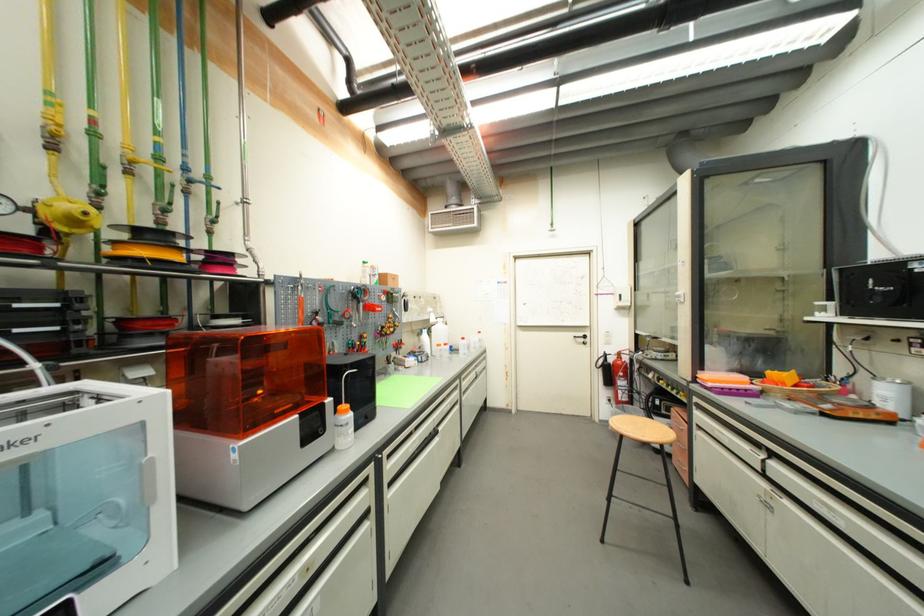
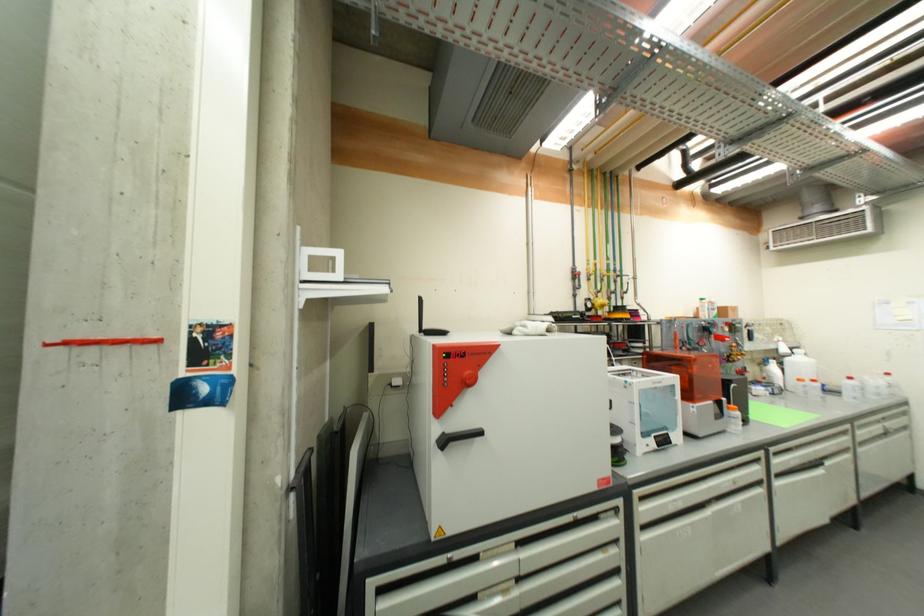
The point at (428,347) is marked in the first image. Where is the corresponding point in the second image?

(774, 378)